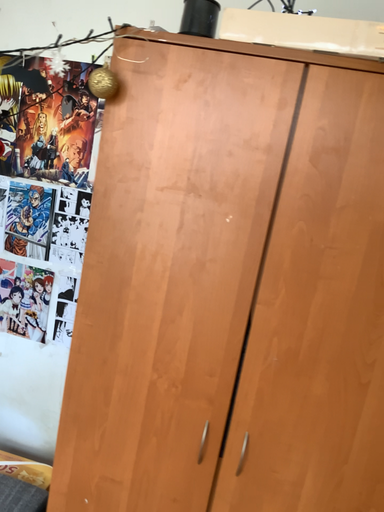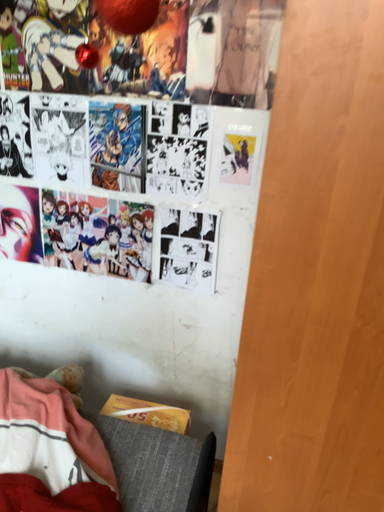
Question: Which way did the camera rotate in the video?

Choices:
 (A) rotated downward
 (B) rotated upward

Answer: (A)